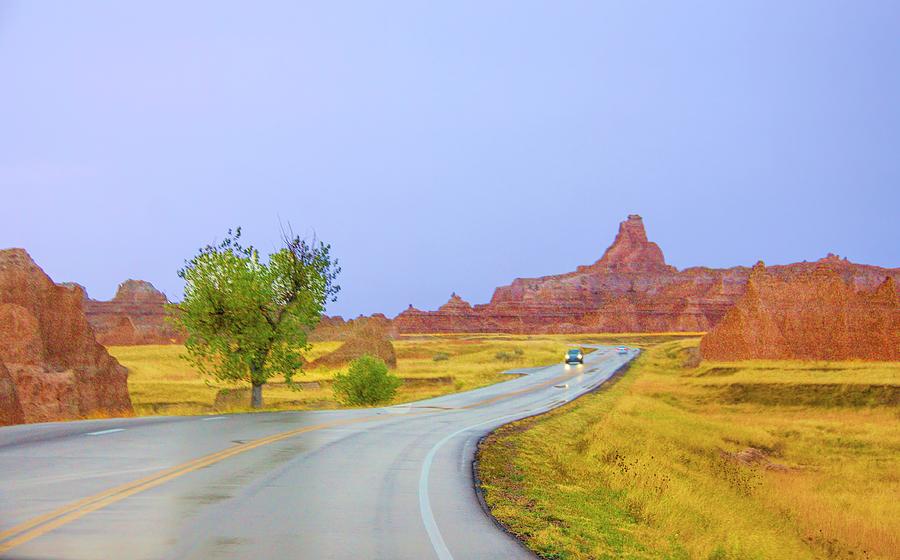
This screenshot has width=900, height=560. Identify the location of light. (569, 358), (579, 358).